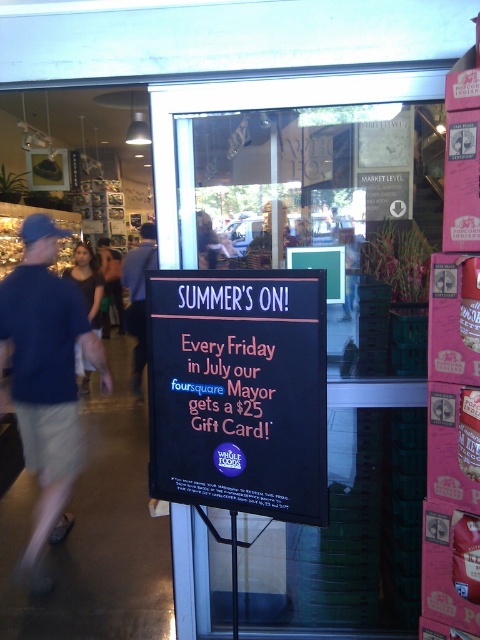
You are standing in front of the Whole Foods Market entrance and see two points marked on the blackboard sign. Which point, point [240,397] or point [135,250], is closer to you?

Point [240,397] is closer to you than point [135,250].

You are a customer at Whole Foods Market and you want to find the denim jacket at lower left and blue denim jeans at center. According to the store layout, which item is located to the right of the other?

The blue denim jeans at center is positioned on the right side of denim jacket at lower left, so the blue denim jeans at center is to the right of the denim jacket at lower left.

You are a delivery person carrying a box that is 2.5 inches thick. You need to pass between the black matte sign at center and the pink neon sign at center to enter the store. Can your box fit through the space between them?

The distance between the black matte sign at center and the pink neon sign at center is 2.26 inches, which is narrower than your 2.5 inches thick box. Your box cannot fit through the space between them.